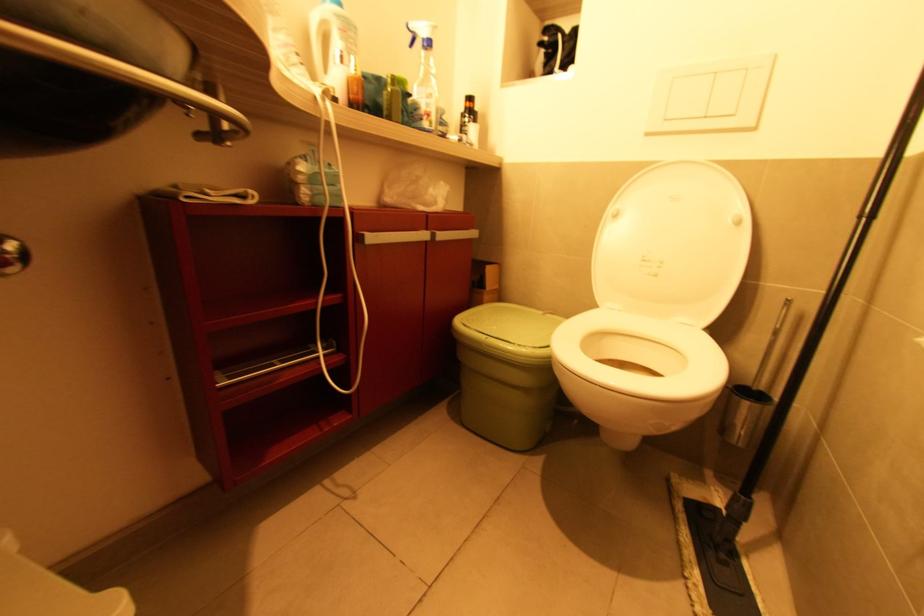
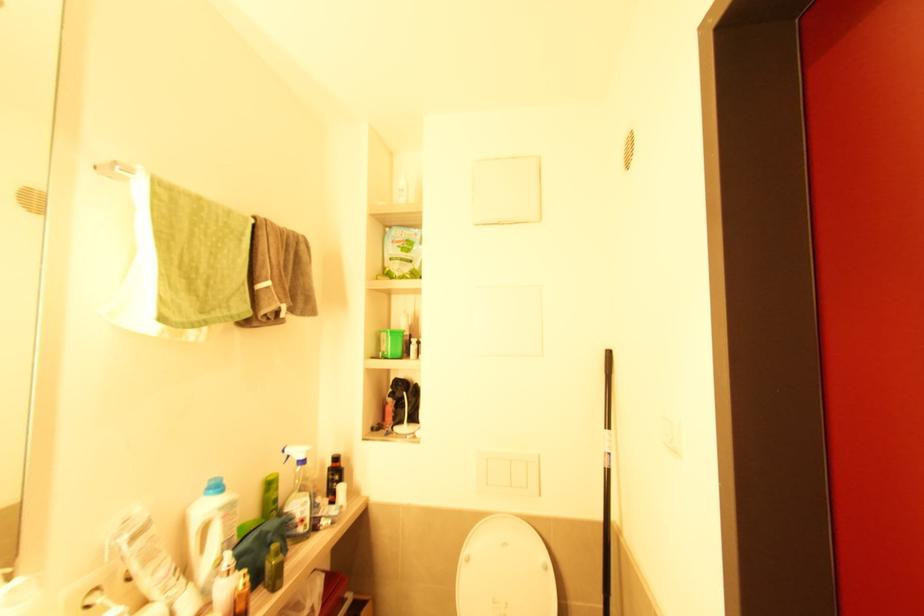
Find the pixel in the second image that matches point (359, 73) in the first image.

(247, 585)